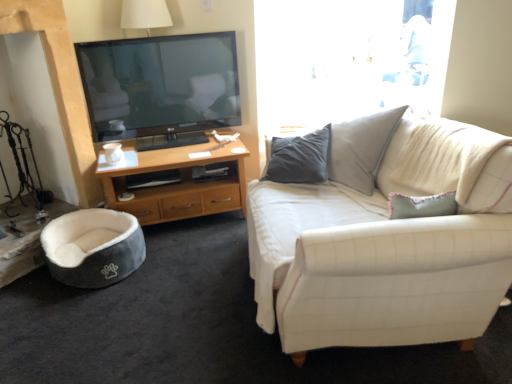
I want to click on empty space that is to the right of velvet grey bean bag at lower left, so click(172, 276).